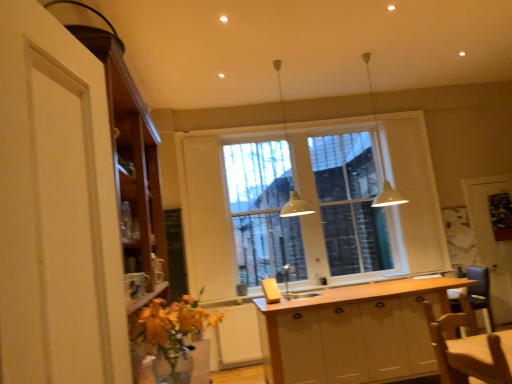
In order to face white ceramic sink at center, should I rotate leftwards or rightwards?

You should rotate right by 4.844 degrees.

Describe the element at coordinates (353, 333) in the screenshot. I see `white wood cabinet at center, which is the 2th cabinetry in front-to-back order` at that location.

Find the location of `clear glass window at center`. clear glass window at center is located at coordinates (310, 203).

In order to click on white matte screen door at center, the 2th screen door from the back in this screenshot , I will do `click(207, 218)`.

In order to face wooden cabinet at left, the second cabinetry when ordered from bottom to top, should I rotate leftwards or rightwards?

Rotate your view left by about 14.228°.

Find the location of a particular element. This screenshot has width=512, height=384. white ceramic sink at center is located at coordinates (288, 285).

Considering the points (295, 294) and (231, 260), which point is behind, point (295, 294) or point (231, 260)?

Positioned behind is point (231, 260).

Consider the image. Is white ceramic sink at center closer to the viewer compared to white matte screen door at center, the 2th screen door from the back?

Yes, white ceramic sink at center is in front of white matte screen door at center, the 2th screen door from the back.

Is white ceramic sink at center oriented towards white matte screen door at center, acting as the 1th screen door starting from the front?

No, white ceramic sink at center is not aimed at white matte screen door at center, acting as the 1th screen door starting from the front.

Is white ceramic sink at center not close to white matte screen door at center, arranged as the second screen door when viewed from the right?

Yes, white ceramic sink at center and white matte screen door at center, arranged as the second screen door when viewed from the right, are quite far apart.

From the image's perspective, is white matte screen door at center, the 2th screen door from the back, positioned above or below white ceramic sink at center?

Clearly, from the image's perspective, white matte screen door at center, the 2th screen door from the back, is above white ceramic sink at center.

Which of these two, white matte screen door at center, arranged as the second screen door when viewed from the right, or white ceramic sink at center, stands taller?

With more height is white matte screen door at center, arranged as the second screen door when viewed from the right.

Who is smaller, white matte screen door at center, which is the first screen door in left-to-right order, or white ceramic sink at center?

white ceramic sink at center.

Is white matte screen door at center, arranged as the second screen door when viewed from the right, facing towards white ceramic sink at center?

No, white matte screen door at center, arranged as the second screen door when viewed from the right, is not turned towards white ceramic sink at center.

Are wooden screen door at right, which appears as the 2th screen door when viewed from the left, and white matte screen door at center, which is the first screen door in left-to-right order, located far from each other?

Absolutely, wooden screen door at right, which appears as the 2th screen door when viewed from the left, is distant from white matte screen door at center, which is the first screen door in left-to-right order.

Considering the relative positions of wooden screen door at right, the second screen door when ordered from front to back, and white matte screen door at center, arranged as the second screen door when viewed from the right, in the image provided, is wooden screen door at right, the second screen door when ordered from front to back, to the left of white matte screen door at center, arranged as the second screen door when viewed from the right, from the viewer's perspective?

Incorrect, wooden screen door at right, the second screen door when ordered from front to back, is not on the left side of white matte screen door at center, arranged as the second screen door when viewed from the right.

Which is behind, wooden screen door at right, the 1th screen door when ordered from right to left, or white matte screen door at center, the 2th screen door from the back?

wooden screen door at right, the 1th screen door when ordered from right to left.

You are a GUI agent. You are given a task and a screenshot of the screen. Output one action in this format:
    pyautogui.click(x=<x>, y=<y>)
    Task: Click on the screen door positioned vertically above the wooden screen door at right, the second screen door when ordered from front to back (from a real-world perspective)
    
    Given the screenshot: What is the action you would take?
    pyautogui.click(x=207, y=218)

Which object is positioned more to the left, white matte pendant light at upper center, which is counted as the 1th light fixture, starting from the right, or white wood cabinet at center, the first cabinetry when ordered from bottom to top?

white wood cabinet at center, the first cabinetry when ordered from bottom to top, is more to the left.

Does white matte pendant light at upper center, which is counted as the 1th light fixture, starting from the right, touch white wood cabinet at center, marked as the 1th cabinetry in a back-to-front arrangement?

white matte pendant light at upper center, which is counted as the 1th light fixture, starting from the right, and white wood cabinet at center, marked as the 1th cabinetry in a back-to-front arrangement, are not in contact.

Starting from the white matte pendant light at upper center, which is counted as the 1th light fixture, starting from the right, which cabinetry is the 1st one in front? Please provide its 2D coordinates.

[(353, 333)]

From a real-world perspective, which is physically above, white ceramic sink at center or white matte pendant light at upper center, which is counted as the 1th light fixture, starting from the right?

white matte pendant light at upper center, which is counted as the 1th light fixture, starting from the right.

Considering the relative sizes of white ceramic sink at center and white matte pendant light at upper center, which is counted as the 1th light fixture, starting from the right, in the image provided, is white ceramic sink at center thinner than white matte pendant light at upper center, which is counted as the 1th light fixture, starting from the right,?

Yes, white ceramic sink at center is thinner than white matte pendant light at upper center, which is counted as the 1th light fixture, starting from the right.

Is white ceramic sink at center aimed at white matte pendant light at upper center, which is the second light fixture from left to right?

No, white ceramic sink at center is not oriented towards white matte pendant light at upper center, which is the second light fixture from left to right.

Which object is thinner, white wood cabinet at center, marked as the second cabinetry in a top-to-bottom arrangement, or wooden cabinet at left, the 1th cabinetry viewed from the top?

With smaller width is wooden cabinet at left, the 1th cabinetry viewed from the top.

Can you confirm if white wood cabinet at center, marked as the second cabinetry in a top-to-bottom arrangement, is positioned to the left of wooden cabinet at left, the second cabinetry in the back-to-front sequence?

In fact, white wood cabinet at center, marked as the second cabinetry in a top-to-bottom arrangement, is to the right of wooden cabinet at left, the second cabinetry in the back-to-front sequence.

From the image's perspective, is white wood cabinet at center, marked as the second cabinetry in a top-to-bottom arrangement, positioned above or below wooden cabinet at left, the 1th cabinetry viewed from the top?

white wood cabinet at center, marked as the second cabinetry in a top-to-bottom arrangement, is below wooden cabinet at left, the 1th cabinetry viewed from the top.

Could you tell me if white wood cabinet at center, which is the 2th cabinetry in front-to-back order, is facing wooden cabinet at left, the second cabinetry when ordered from bottom to top?

No.

Considering the sizes of objects white ceramic sink at center and clear glass window at center in the image provided, who is smaller, white ceramic sink at center or clear glass window at center?

white ceramic sink at center.

Can you confirm if white ceramic sink at center is wider than clear glass window at center?

Indeed, white ceramic sink at center has a greater width compared to clear glass window at center.

How much distance is there between white ceramic sink at center and clear glass window at center?

They are 1.65 meters apart.

Is white ceramic sink at center far away from clear glass window at center?

Absolutely, white ceramic sink at center is distant from clear glass window at center.

The image size is (512, 384). Find the location of `the 1st screen door behind the white ceramic sink at center, counting from the anchor's position`. the 1st screen door behind the white ceramic sink at center, counting from the anchor's position is located at coordinates (207, 218).

Find the location of a particular element. The height and width of the screenshot is (384, 512). sink located below the white matte screen door at center, arranged as the second screen door when viewed from the right (from the image's perspective) is located at coordinates (288, 285).

When comparing their distances from wooden screen door at right, which appears as the 2th screen door when viewed from the left, does wooden cabinet at left, which ranks as the 2th cabinetry in right-to-left order, or white ceramic sink at center seem closer?

white ceramic sink at center.

Looking at the image, which one is located closer to white matte pendant light at center, acting as the 2th light fixture starting from the right, clear glass window at center or wooden cabinet at left, the second cabinetry in the back-to-front sequence?

clear glass window at center is closer to white matte pendant light at center, acting as the 2th light fixture starting from the right.

Based on their spatial positions, is white wood cabinet at center, which is the 2th cabinetry in front-to-back order, or wooden screen door at right, the second screen door when ordered from front to back, closer to clear glass window at center?

white wood cabinet at center, which is the 2th cabinetry in front-to-back order, is positioned closer to the anchor clear glass window at center.

From the image, which object appears to be farther from clear glass window at center, wooden cabinet at left, which is the 1th cabinetry from front to back, or white wood cabinet at center, marked as the second cabinetry in a top-to-bottom arrangement?

wooden cabinet at left, which is the 1th cabinetry from front to back.

Which object lies nearer to the anchor point wooden screen door at right, which appears as the 2th screen door when viewed from the left, white ceramic sink at center or white matte pendant light at center, which is counted as the 1th light fixture, starting from the left?

The object closer to wooden screen door at right, which appears as the 2th screen door when viewed from the left, is white matte pendant light at center, which is counted as the 1th light fixture, starting from the left.

Which object lies further to the anchor point white matte screen door at center, the 2th screen door from the back, white wood cabinet at center, marked as the 1th cabinetry in a back-to-front arrangement, or light wood countertop at center?

white wood cabinet at center, marked as the 1th cabinetry in a back-to-front arrangement, is further to white matte screen door at center, the 2th screen door from the back.

Consider the image. From the image, which object appears to be farther from white matte pendant light at upper center, which is counted as the 1th light fixture, starting from the right, wooden chair at lower right or wooden cabinet at left, the first cabinetry positioned from the left?

wooden cabinet at left, the first cabinetry positioned from the left, is positioned further to the anchor white matte pendant light at upper center, which is counted as the 1th light fixture, starting from the right.

When comparing their distances from light wood countertop at center, does wooden cabinet at left, the 1th cabinetry viewed from the top, or wooden screen door at right, the 1th screen door when ordered from right to left, seem closer?

wooden screen door at right, the 1th screen door when ordered from right to left.

What are the coordinates of `sink situated between white matte screen door at center, the 2th screen door from the back, and wooden screen door at right, which appears as the 2th screen door when viewed from the left, from left to right` in the screenshot? It's located at (288, 285).

The width and height of the screenshot is (512, 384). What are the coordinates of `sink between wooden chair at lower right and light wood countertop at center along the z-axis` in the screenshot? It's located at (288, 285).

Identify the location of window located between white ceramic sink at center and wooden screen door at right, the 1th screen door when ordered from right to left, in the left-right direction. This screenshot has width=512, height=384. (310, 203).

You are a GUI agent. You are given a task and a screenshot of the screen. Output one action in this format:
    pyautogui.click(x=<x>, y=<y>)
    Task: Click on the chair between wooden cabinet at left, which ranks as the 2th cabinetry in right-to-left order, and white ceramic sink at center in the front-back direction
    
    Given the screenshot: What is the action you would take?
    pyautogui.click(x=469, y=351)